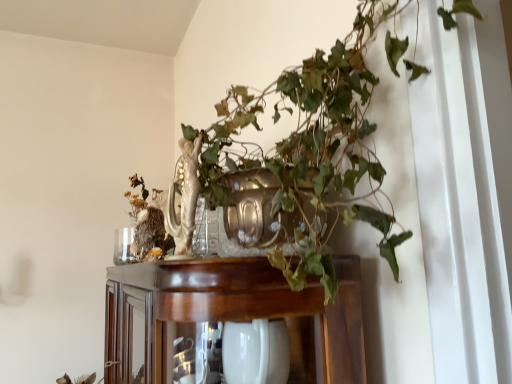
Question: Is porcelain statue at upper center situated inside shiny brown cabinet at center or outside?

Choices:
 (A) inside
 (B) outside

Answer: (B)

Question: From a real-world perspective, relative to shiny brown cabinet at center, is porcelain statue at upper center vertically above or below?

Choices:
 (A) below
 (B) above

Answer: (B)

Question: Is point (182, 220) positioned closer to the camera than point (216, 299)?

Choices:
 (A) closer
 (B) farther

Answer: (B)

Question: Considering the positions of shiny brown cabinet at center and porcelain statue at upper center in the image, is shiny brown cabinet at center wider or thinner than porcelain statue at upper center?

Choices:
 (A) wide
 (B) thin

Answer: (A)

Question: Considering the relative positions of shiny brown cabinet at center and porcelain statue at upper center in the image provided, is shiny brown cabinet at center to the left or to the right of porcelain statue at upper center?

Choices:
 (A) left
 (B) right

Answer: (A)

Question: Based on their sizes in the image, would you say shiny brown cabinet at center is bigger or smaller than porcelain statue at upper center?

Choices:
 (A) small
 (B) big

Answer: (B)

Question: From their relative heights in the image, would you say shiny brown cabinet at center is taller or shorter than porcelain statue at upper center?

Choices:
 (A) tall
 (B) short

Answer: (A)